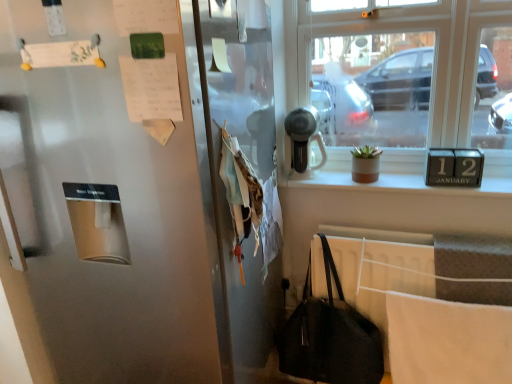
Question: Is satin silver hairdryer at upper center inside or outside of black leather handbag at lower right?

Choices:
 (A) outside
 (B) inside

Answer: (A)

Question: Is point (324, 162) closer or farther from the camera than point (293, 367)?

Choices:
 (A) closer
 (B) farther

Answer: (B)

Question: Estimate the real-world distances between objects in this image. Which object is closer to the satin silver refrigerator at left?

Choices:
 (A) white paper at upper left, which is the first paper in right-to-left order
 (B) satin silver hairdryer at upper center
 (C) black leather handbag at lower right
 (D) white matte paper at upper left, the first paper when ordered from top to bottom
 (E) clear glass window at upper right

Answer: (A)

Question: Which object is positioned farthest from the white matte paper at upper left, the first paper when ordered from top to bottom?

Choices:
 (A) satin silver hairdryer at upper center
 (B) clear glass window at upper right
 (C) black leather handbag at lower right
 (D) satin silver refrigerator at left
 (E) white paper at upper left, which is the second paper from left to right

Answer: (C)